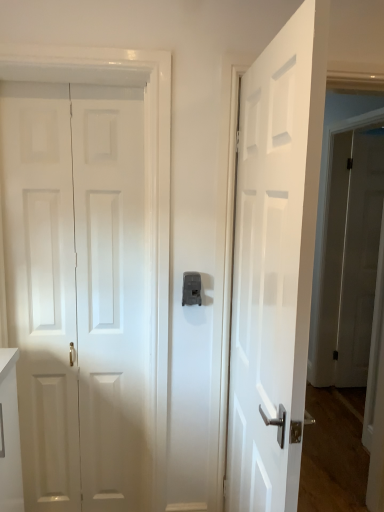
Question: Is white matte door at left, positioned as the first door in left-to-right order, inside white glossy door at right, which ranks as the 3th door in left-to-right order?

Choices:
 (A) yes
 (B) no

Answer: (B)

Question: Is white glossy door at right, positioned as the 3th door in front-to-back order, far from white matte door at left, positioned as the 2th door in front-to-back order?

Choices:
 (A) no
 (B) yes

Answer: (B)

Question: Is white glossy door at right, the first door from the right, aimed at white matte door at left, positioned as the first door in left-to-right order?

Choices:
 (A) no
 (B) yes

Answer: (A)

Question: From a real-world perspective, is white glossy door at right, which ranks as the 3th door in left-to-right order, physically below white matte door at left, marked as the second door in a back-to-front arrangement?

Choices:
 (A) yes
 (B) no

Answer: (B)

Question: From the image's perspective, is white glossy door at right, placed as the 1th door when sorted from back to front, located above white matte door at left, positioned as the first door in left-to-right order?

Choices:
 (A) yes
 (B) no

Answer: (A)

Question: Is white glossy door at right, placed as the 1th door when sorted from back to front, bigger or smaller than white glossy door at center, which is the first door from front to back?

Choices:
 (A) small
 (B) big

Answer: (A)

Question: Is white glossy door at right, positioned as the 3th door in front-to-back order, wider or thinner than white glossy door at center, the 3th door positioned from the back?

Choices:
 (A) wide
 (B) thin

Answer: (B)

Question: From a real-world perspective, is white glossy door at right, which ranks as the 3th door in left-to-right order, positioned above or below white glossy door at center, the 3th door positioned from the back?

Choices:
 (A) above
 (B) below

Answer: (B)

Question: Relative to white glossy door at center, the 2th door from the right, is white glossy door at right, the first door from the right, in front or behind?

Choices:
 (A) behind
 (B) front

Answer: (A)

Question: In the image, is matte gray latch at center positioned in front of or behind white glossy door at center, the 3th door positioned from the back?

Choices:
 (A) front
 (B) behind

Answer: (B)

Question: Is matte gray latch at center wider or thinner than white glossy door at center, the 2th door from the right?

Choices:
 (A) thin
 (B) wide

Answer: (A)

Question: Considering the positions of matte gray latch at center and white glossy door at center, which is the first door from front to back, in the image, is matte gray latch at center taller or shorter than white glossy door at center, which is the first door from front to back,?

Choices:
 (A) short
 (B) tall

Answer: (A)

Question: Is matte gray latch at center to the left or to the right of white glossy door at center, which is the first door from front to back, in the image?

Choices:
 (A) right
 (B) left

Answer: (B)

Question: Is white glossy door at center, which is the first door from front to back, wider or thinner than white glossy door at right, positioned as the 3th door in front-to-back order?

Choices:
 (A) thin
 (B) wide

Answer: (B)

Question: From a real-world perspective, is white glossy door at center, which is the first door from front to back, above or below white glossy door at right, positioned as the 3th door in front-to-back order?

Choices:
 (A) above
 (B) below

Answer: (A)